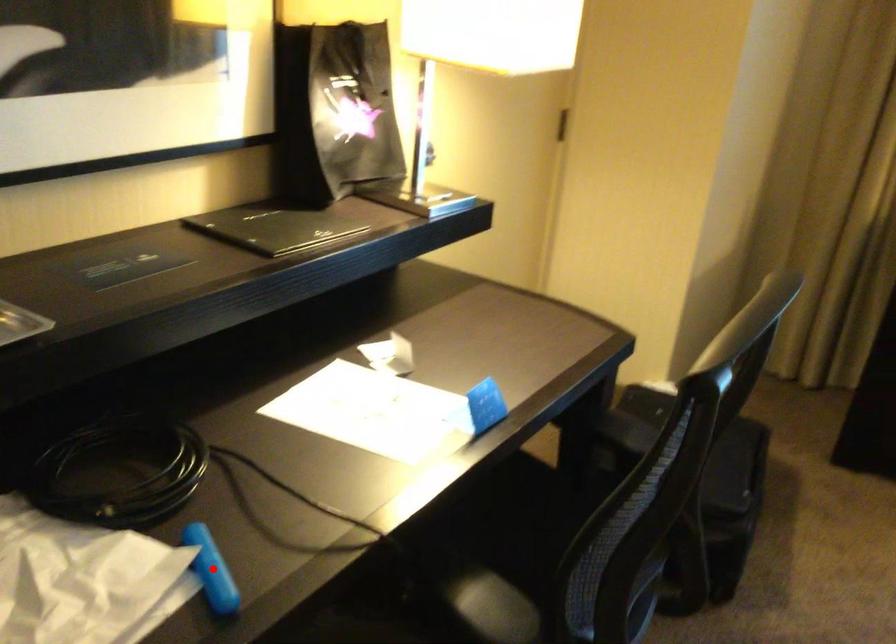
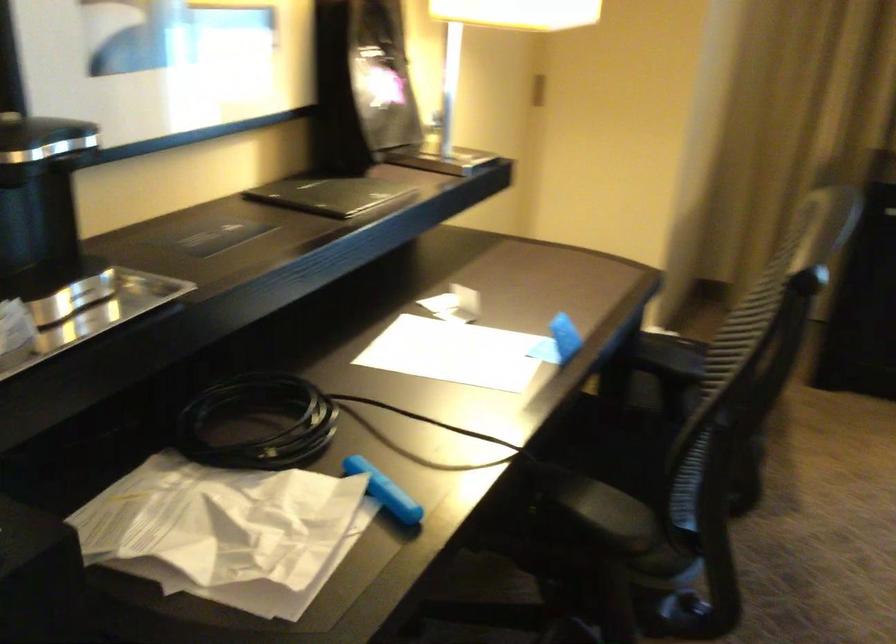
Where in the second image is the point corresponding to the highlighted location from the first image?

(384, 491)